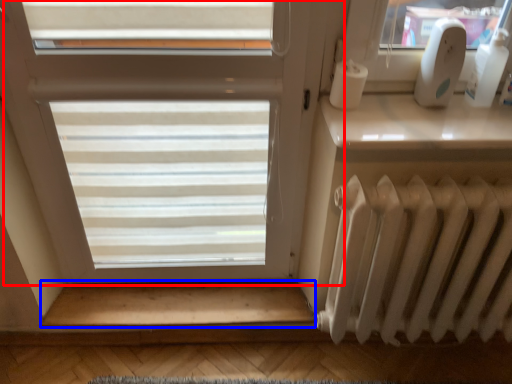
Question: Which object appears closest to the camera in this image, window (highlighted by a red box) or stairwell (highlighted by a blue box)?

Choices:
 (A) window
 (B) stairwell

Answer: (A)